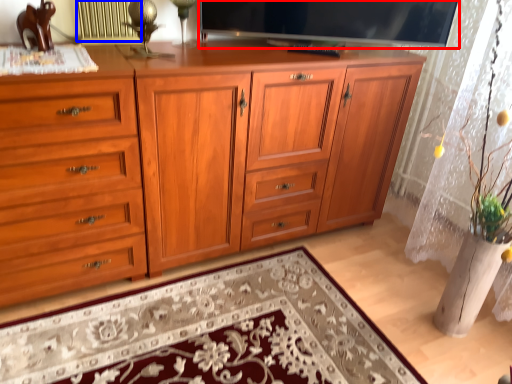
Question: Which point is closer to the camera, television (highlighted by a red box) or radiator (highlighted by a blue box)?

Choices:
 (A) television
 (B) radiator

Answer: (B)